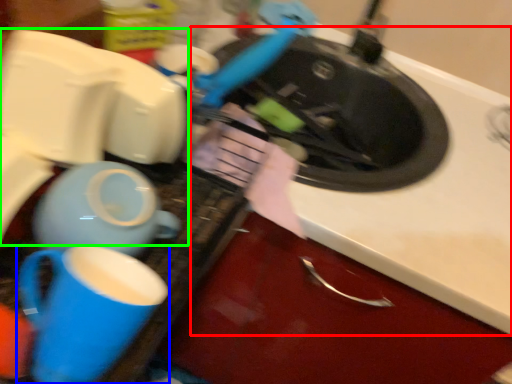
Question: Which object is the farthest from counter top (highlighted by a red box)? Choose among these: coffee cup (highlighted by a blue box) or appliance (highlighted by a green box).

Choices:
 (A) coffee cup
 (B) appliance

Answer: (A)